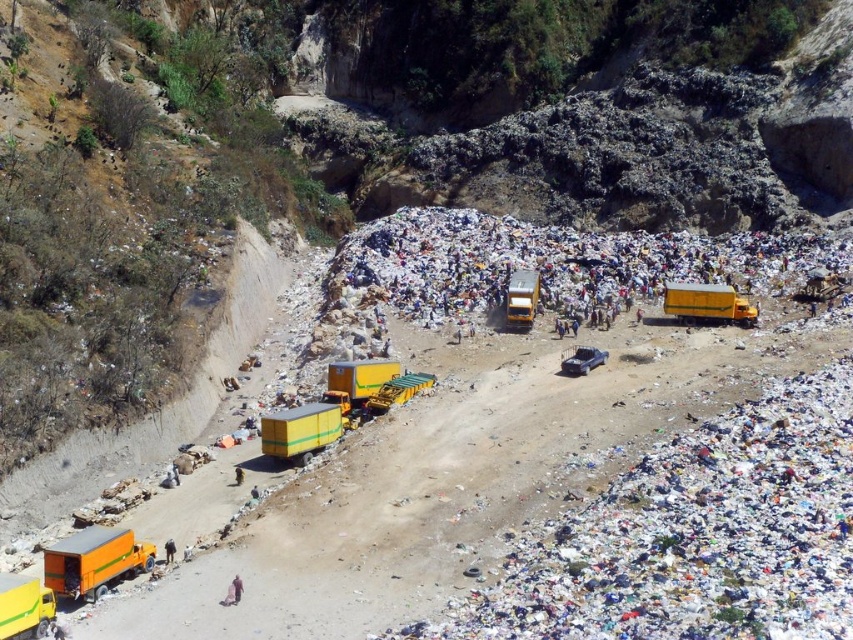
Question: Can you confirm if orange matte truck at lower left is positioned to the left of yellow matte truck at lower left?

Choices:
 (A) yes
 (B) no

Answer: (B)

Question: Can you confirm if orange matte truck at lower left is wider than brown fabric person at lower center?

Choices:
 (A) yes
 (B) no

Answer: (B)

Question: Which object appears closest to the camera in this image?

Choices:
 (A) brown fabric person at lower center
 (B) yellow matte truck at center
 (C) orange matte truck at lower left

Answer: (C)

Question: Estimate the real-world distances between objects in this image. Which object is farther from the orange matte truck at lower left?

Choices:
 (A) yellow matte truck at right
 (B) yellow matte truck at center

Answer: (A)

Question: Is yellow matte truck at right positioned in front of yellow matte truck at center?

Choices:
 (A) no
 (B) yes

Answer: (B)

Question: Which point is farther to the camera?

Choices:
 (A) yellow matte truck at center
 (B) yellow matte truck at right

Answer: (A)